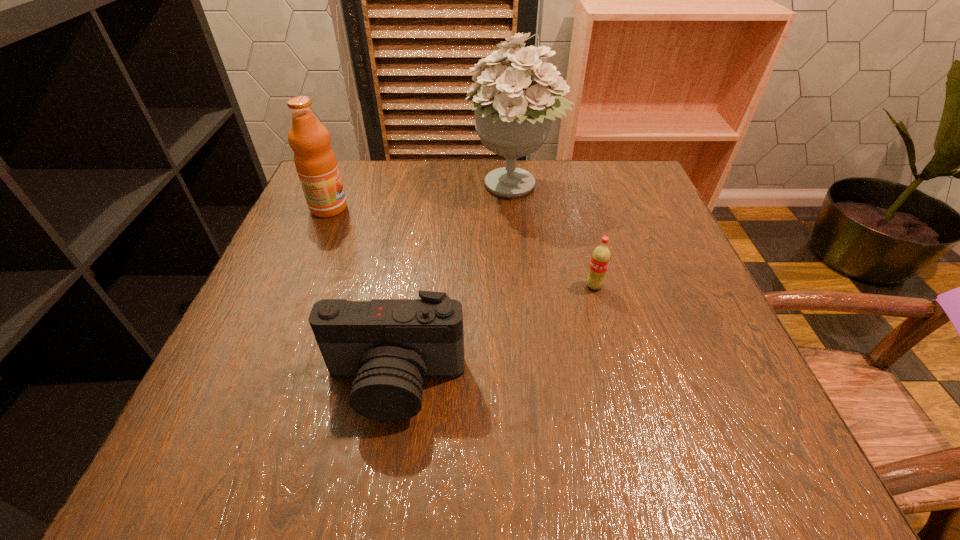
In the image, there is a desktop. At what (x,y) coordinates should I click in order to perform the action: click on vacant space at the far right corner. Please return your answer as a coordinate pair (x, y). The image size is (960, 540). Looking at the image, I should click on (599, 174).

Locate an element on the screen. vacant region at the near right corner is located at coordinates (723, 472).

You are a GUI agent. You are given a task and a screenshot of the screen. Output one action in this format:
    pyautogui.click(x=<x>, y=<y>)
    Task: Click on the vacant point located between the camera and the second tallest object
    Image resolution: width=960 pixels, height=540 pixels.
    Given the screenshot: What is the action you would take?
    pyautogui.click(x=362, y=295)

Locate an element on the screen. The image size is (960, 540). vacant area that lies between the camera and the tallest object is located at coordinates (455, 285).

Where is `vacant space in between the bouquet and the second tallest object`? vacant space in between the bouquet and the second tallest object is located at coordinates (421, 197).

Image resolution: width=960 pixels, height=540 pixels. In order to click on vacant area that lies between the shortest object and the tallest object in this screenshot , I will do `click(555, 236)`.

The height and width of the screenshot is (540, 960). I want to click on free spot between the fruit juice and the shortest object, so tap(462, 247).

Where is `unoccupied position between the second nearest object and the third tallest object`? unoccupied position between the second nearest object and the third tallest object is located at coordinates (494, 334).

Identify the location of vacant space that's between the leftmost object and the tallest object. The height and width of the screenshot is (540, 960). (421, 197).

This screenshot has width=960, height=540. Find the location of `empty space that is in between the camera and the shortest object`. empty space that is in between the camera and the shortest object is located at coordinates (494, 334).